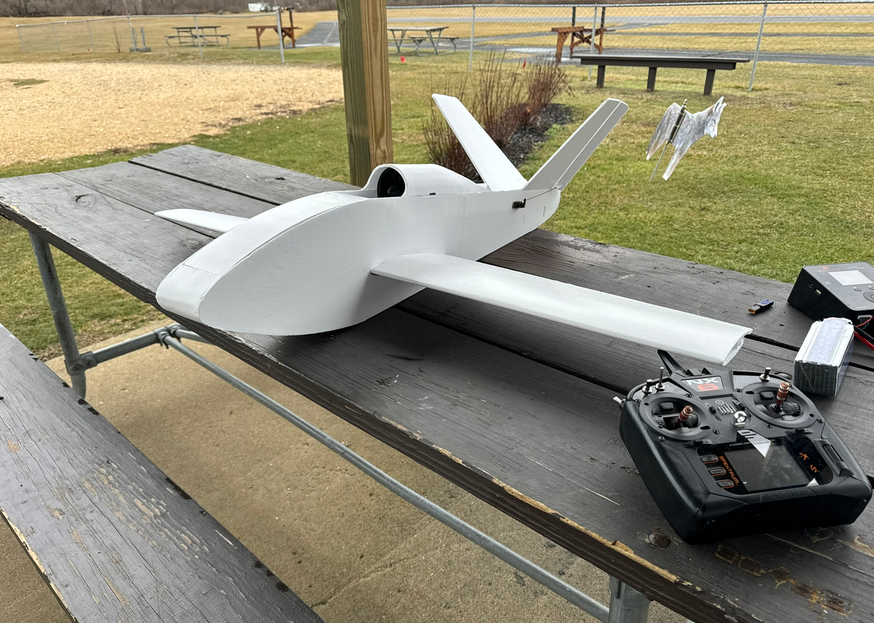
Locate an element on the screen. The height and width of the screenshot is (623, 874). table is located at coordinates (475, 412).